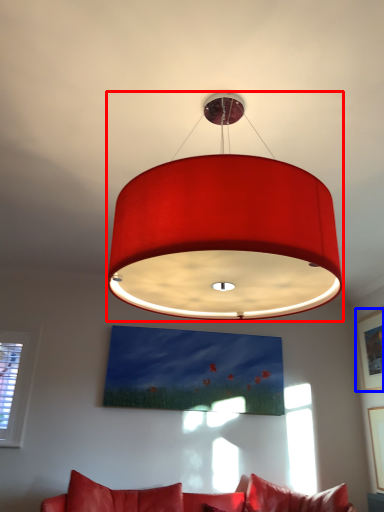
Question: Which point is closer to the camera, lamp (highlighted by a red box) or picture frame (highlighted by a blue box)?

Choices:
 (A) lamp
 (B) picture frame

Answer: (A)